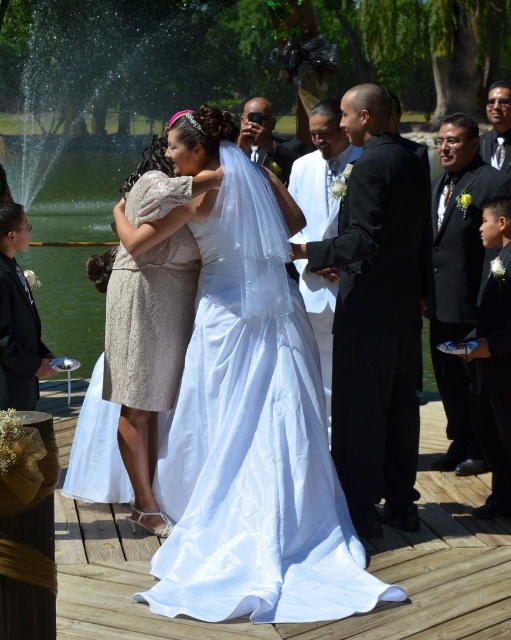
You are standing at the point with coordinates point (312,288) and want to walk towards the fountain in the background. Is the point (377,180) blocking your path?

Point (377,180) is in front of point (312,288), so yes, it would block your path to the fountain in the background.

You are a photographer at the wedding. You need to capture a closeup of the black satin suit at center and the matte black suit at center. Which one is positioned lower in the image?

The black satin suit at center is positioned lower than the matte black suit at center in the image.

You are a photographer at the wedding and need to position two guests wearing the black satin suit at center and the matte black suit at center so they can both fit in the frame without overlapping. Based on their width, which guest should you place closer to the edge?

The black satin suit at center is wider than the matte black suit at center, so you should place the black satin suit at center closer to the edge to ensure both fit in the frame without overlapping.